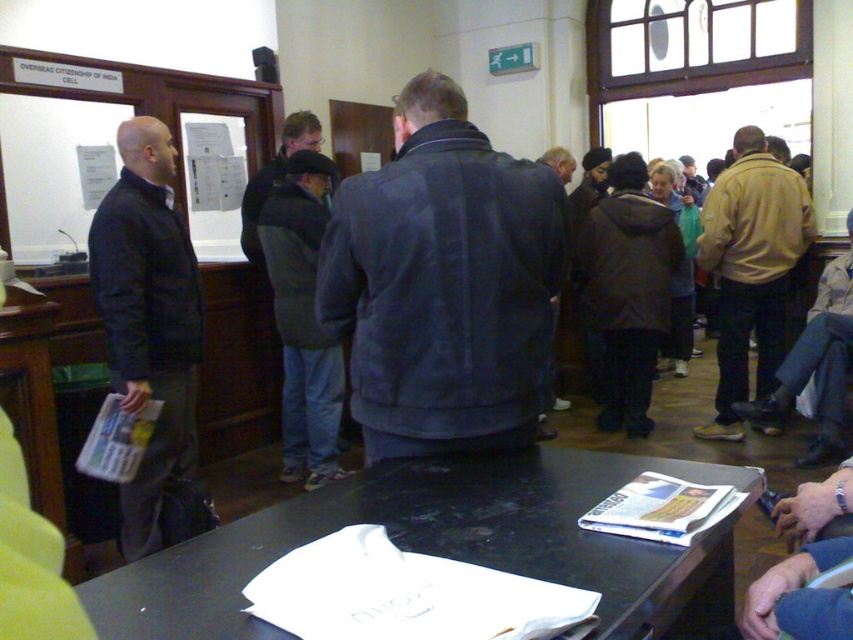
You are standing in the waiting area and need to determine the distance between two points in the scene. The first point is at coordinates point (183, 576) and the second is at point (787, 268). Given that the distance between these points is 2.5 meters, can you estimate how far apart they are in real life?

The two points are 2.5 meters apart in real life.

You are organizing a small event and need to place two items on a table. The white paper at center and the beige suede jacket at right must be placed such that they fit within the table space. Based on their sizes, which item should you place first to ensure both can fit?

The white paper at center occupies less space than beige suede jacket at right. Therefore, place the beige suede jacket at right first to accommodate its larger size, then the white paper at center will fit alongside it.

You are standing at the point labeled point (830,266) and want to walk to the exit located at point (775,352). Is there a clear path between these two points without needing to go around any obstacles?

Point (775,352) is behind point (830,266), so there is a clear path between them without obstacles. You can walk directly from point (830,266) to point (775,352).